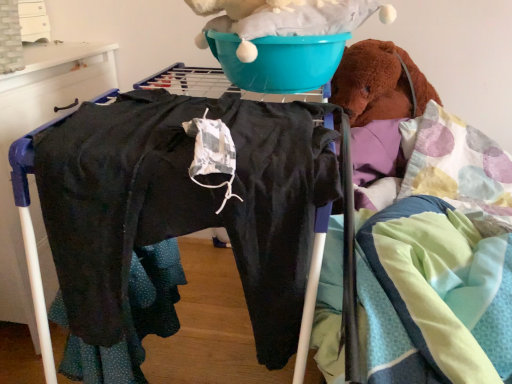
Question: Would you say dark gray fabric pants at left is to the left or to the right of teal plastic basin at upper center in the picture?

Choices:
 (A) left
 (B) right

Answer: (A)

Question: Based on their sizes in the image, would you say dark gray fabric pants at left is bigger or smaller than teal plastic basin at upper center?

Choices:
 (A) small
 (B) big

Answer: (B)

Question: From a real-world perspective, is dark gray fabric pants at left physically located above or below teal plastic basin at upper center?

Choices:
 (A) above
 (B) below

Answer: (B)

Question: In terms of size, does teal plastic basin at upper center appear bigger or smaller than dark gray fabric pants at left?

Choices:
 (A) big
 (B) small

Answer: (B)

Question: Relative to dark gray fabric pants at left, is teal plastic basin at upper center in front or behind?

Choices:
 (A) behind
 (B) front

Answer: (B)

Question: From the image's perspective, is teal plastic basin at upper center located above or below dark gray fabric pants at left?

Choices:
 (A) below
 (B) above

Answer: (B)

Question: From a real-world perspective, is teal plastic basin at upper center physically located above or below dark gray fabric pants at left?

Choices:
 (A) above
 (B) below

Answer: (A)